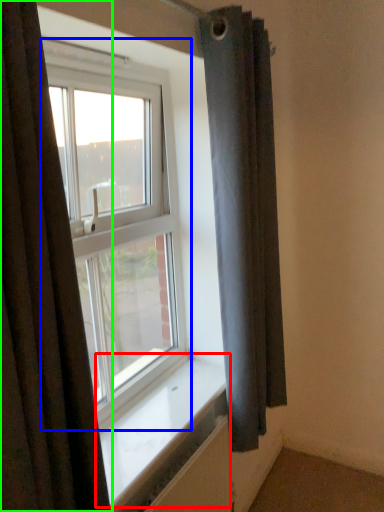
Question: Which object is the farthest from window sill (highlighted by a red box)? Choose among these: window (highlighted by a blue box) or curtain (highlighted by a green box).

Choices:
 (A) window
 (B) curtain

Answer: (B)